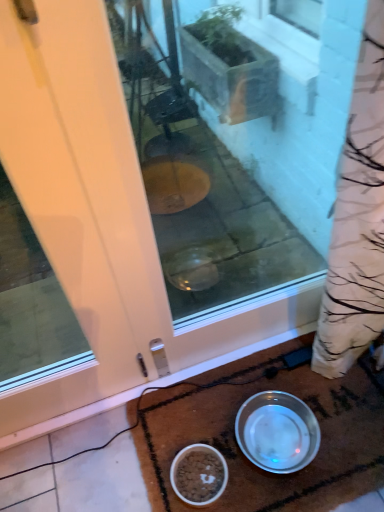
Find the location of `free region on the left part of white glossy bowl at lower center, which is the 1th bowl in left-to-right order`. free region on the left part of white glossy bowl at lower center, which is the 1th bowl in left-to-right order is located at coordinates (150, 472).